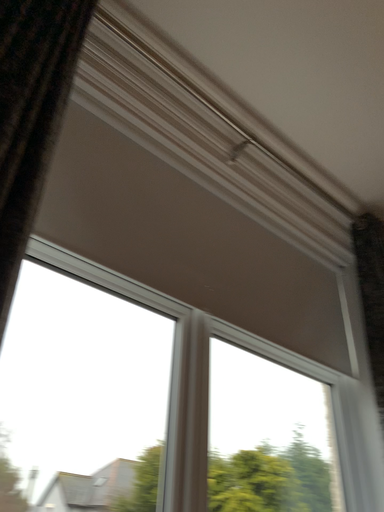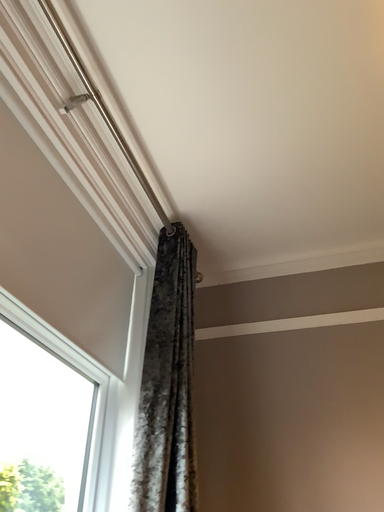
Question: Which way did the camera rotate in the video?

Choices:
 (A) rotated left
 (B) rotated right

Answer: (B)